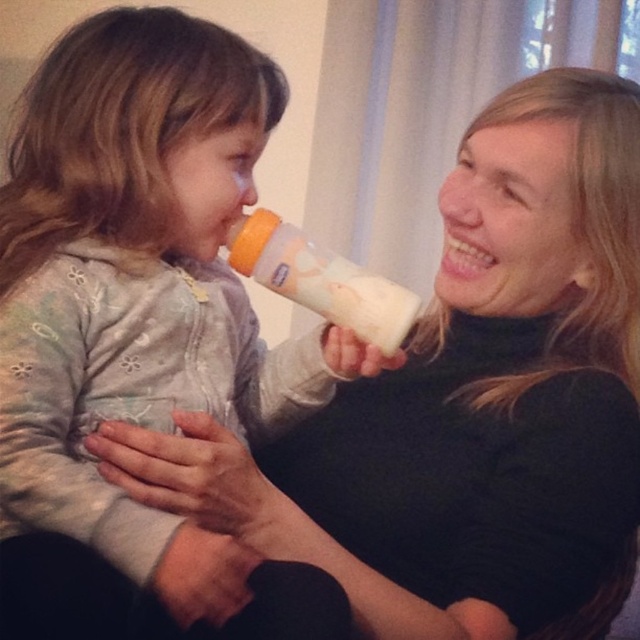
Question: Where is white soft baby bottle at center located in relation to white matte bottle at center in the image?

Choices:
 (A) right
 (B) left

Answer: (B)

Question: Which point is closer to the camera taking this photo?

Choices:
 (A) (369, 305)
 (B) (266, 429)

Answer: (A)

Question: Which point is closer to the camera?

Choices:
 (A) white soft baby bottle at center
 (B) white matte bottle at center

Answer: (A)

Question: Observing the image, what is the correct spatial positioning of white soft baby bottle at center in reference to white matte bottle at center?

Choices:
 (A) above
 (B) below

Answer: (B)

Question: Is white soft baby bottle at center further to camera compared to white matte bottle at center?

Choices:
 (A) yes
 (B) no

Answer: (B)